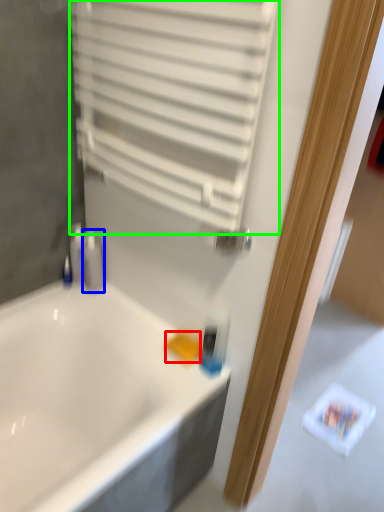
Question: Which object is the farthest from soap (highlighted by a red box)? Choose among these: toiletry (highlighted by a blue box) or shutter (highlighted by a green box).

Choices:
 (A) toiletry
 (B) shutter

Answer: (B)